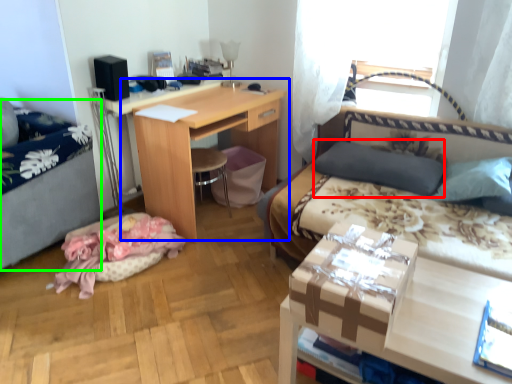
Question: Considering the real-world distances, which object is farthest from pillow (highlighted by a red box)? table (highlighted by a blue box) or hospital bed (highlighted by a green box)?

Choices:
 (A) table
 (B) hospital bed

Answer: (B)